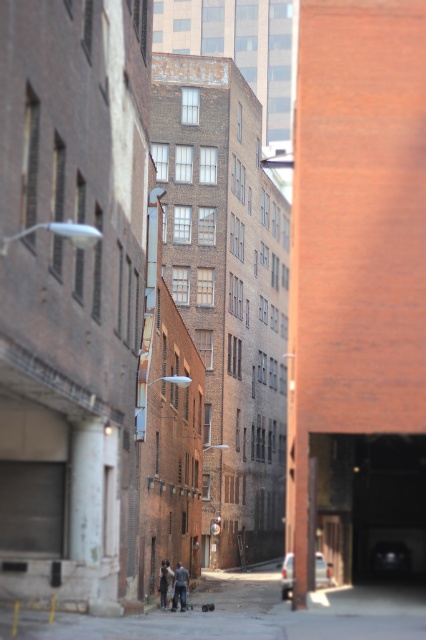
You are a drone operator trying to navigate through this alleyway. You need to fly your drone from the starting point at point (x=420, y=596) to the endpoint at point (x=161, y=605). Considering the alleyway is narrow and the buildings are tall, will the drone have to ascend or descend to reach the endpoint?

The drone will have to descend because point (x=420, y=596) is closer to the camera than point (x=161, y=605), indicating that the endpoint is further away and lower in elevation.

You are a delivery person standing at the entrance of the alleyway. You need to place a package on the ground at the exact center of the alley. The dark gray jeans at center are currently occupying the spot. Can you move the jeans to the right side of the alley to make space?

The dark gray jeans at center are located at point (x=180, y=586), which is the exact center of the alley. Moving them to the right side would free up the center spot for the package.

You are a delivery person carrying a package and need to walk through the narrow alleyway. You see the dark gray jeans at center and the dark gray jacket at lower center lying on the ground. Which item is closer to you as you approach the alley?

The dark gray jeans at center is in front of the dark gray jacket at lower center, so the dark gray jeans at center is closer to you.